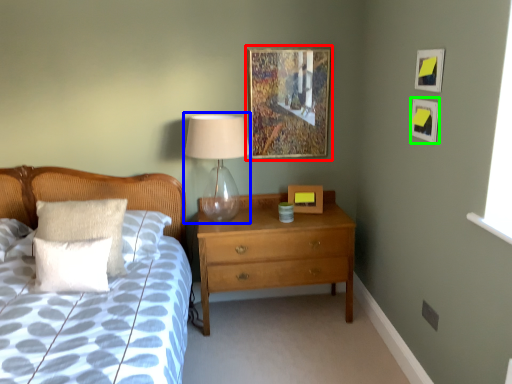
Question: Based on their relative distances, which object is farther from picture frame (highlighted by a red box)? Choose from table lamp (highlighted by a blue box) and picture frame (highlighted by a green box).

Choices:
 (A) table lamp
 (B) picture frame

Answer: (B)